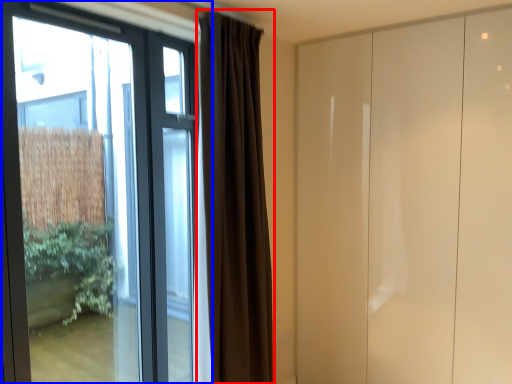
Question: Which point is closer to the camera, curtain (highlighted by a red box) or window (highlighted by a blue box)?

Choices:
 (A) curtain
 (B) window

Answer: (B)